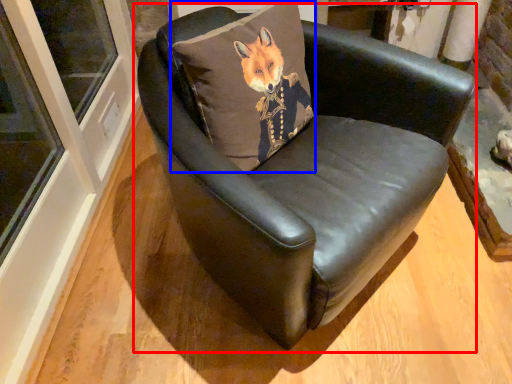
Question: Which object is closer to the camera taking this photo, chair (highlighted by a red box) or pillow (highlighted by a blue box)?

Choices:
 (A) chair
 (B) pillow

Answer: (A)